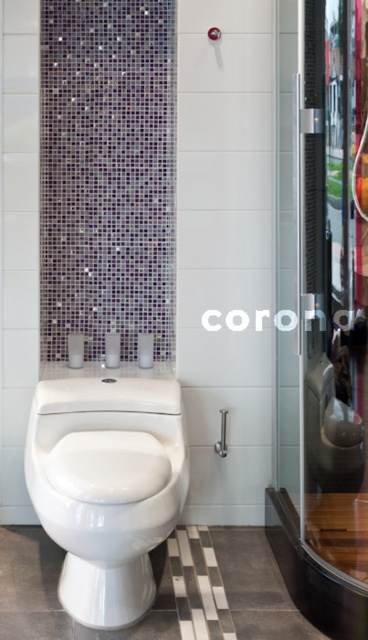
Question: Where is transparent glass shower door at right located in relation to satin nickel shower handle at upper center in the image?

Choices:
 (A) above
 (B) below

Answer: (A)

Question: Which object is the farthest from the white glossy toilet at lower left?

Choices:
 (A) transparent glass shower door at right
 (B) satin nickel shower handle at upper center

Answer: (A)

Question: Which object is positioned farthest from the satin nickel shower handle at upper center?

Choices:
 (A) white glossy toilet at lower left
 (B) transparent glass shower door at right

Answer: (B)

Question: Is transparent glass shower door at right thinner than satin nickel shower handle at upper center?

Choices:
 (A) yes
 (B) no

Answer: (B)

Question: Which object is positioned closest to the white glossy toilet at lower left?

Choices:
 (A) satin nickel shower handle at upper center
 (B) transparent glass shower door at right

Answer: (A)

Question: Can you confirm if transparent glass shower door at right is bigger than satin nickel shower handle at upper center?

Choices:
 (A) yes
 (B) no

Answer: (A)